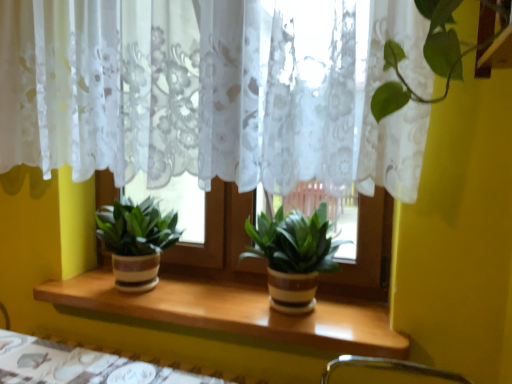
Find the location of a particular element. This screenshot has width=512, height=384. unoccupied region to the right of green matte plant at center, which is the 2th houseplant in left-to-right order is located at coordinates (365, 321).